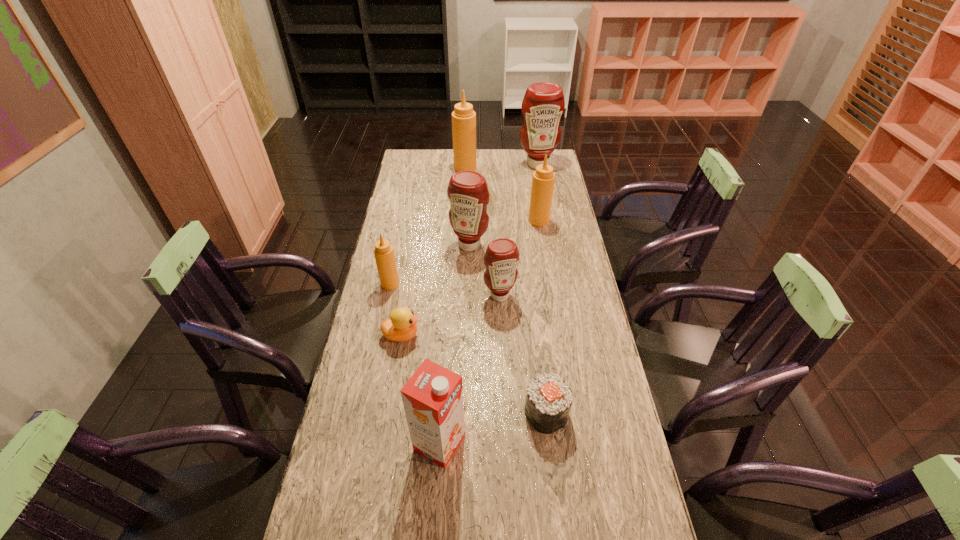
Where is `vacant space located 0.140m on the right of the leftmost condiment`? This screenshot has width=960, height=540. vacant space located 0.140m on the right of the leftmost condiment is located at coordinates (439, 284).

Find the location of a particular element. vacant space located 0.210m on the back of the nearest red condiment is located at coordinates (498, 248).

Identify the location of vacant point located on the face of the yellow duckling. (462, 335).

Where is `blank space located on the right of the sushi`? blank space located on the right of the sushi is located at coordinates (616, 413).

You are a GUI agent. You are given a task and a screenshot of the screen. Output one action in this format:
    pyautogui.click(x=<x>, y=<y>)
    Task: Click on the condiment located in the left edge section of the desktop
    Image resolution: width=960 pixels, height=540 pixels.
    Given the screenshot: What is the action you would take?
    pyautogui.click(x=384, y=255)

The width and height of the screenshot is (960, 540). Find the location of `duckling located at the left edge`. duckling located at the left edge is located at coordinates [401, 326].

The height and width of the screenshot is (540, 960). In order to click on sushi located in the right edge section of the desktop in this screenshot , I will do `click(548, 401)`.

The image size is (960, 540). I want to click on object located at the far right corner, so click(543, 104).

This screenshot has height=540, width=960. In order to click on vacant space at the far edge of the desktop in this screenshot , I will do `click(449, 154)`.

The image size is (960, 540). I want to click on vacant area at the left edge, so point(400,345).